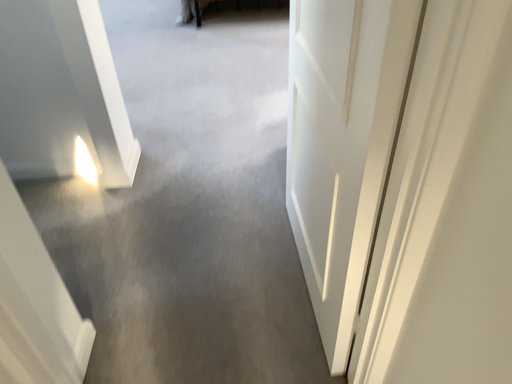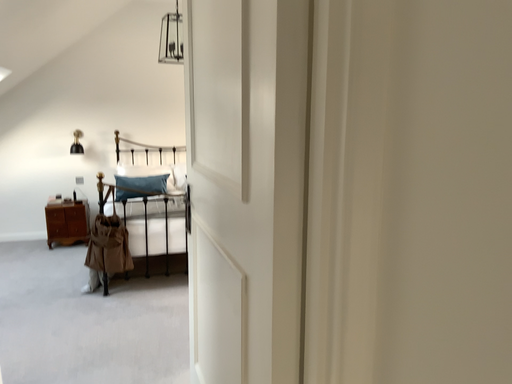
Question: How did the camera likely rotate when shooting the video?

Choices:
 (A) rotated left
 (B) rotated right

Answer: (B)